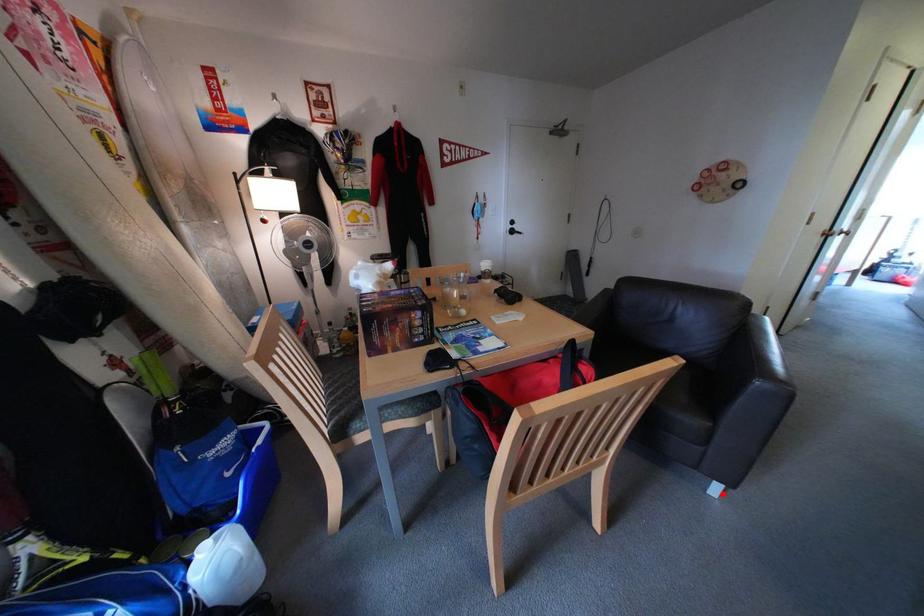
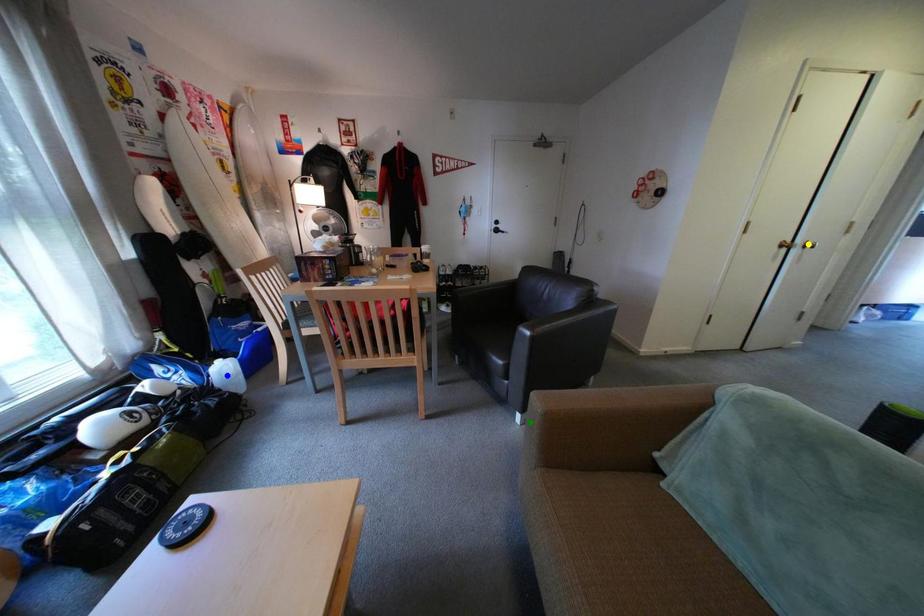
Question: I am providing you with two images of the same scene from different viewpoints. A red point is marked on the first image. You are given multiple points on the second image. Which spot in image 2 lines up with the point in image 1?

Choices:
 (A) blue point
 (B) green point
 (C) yellow point

Answer: (B)